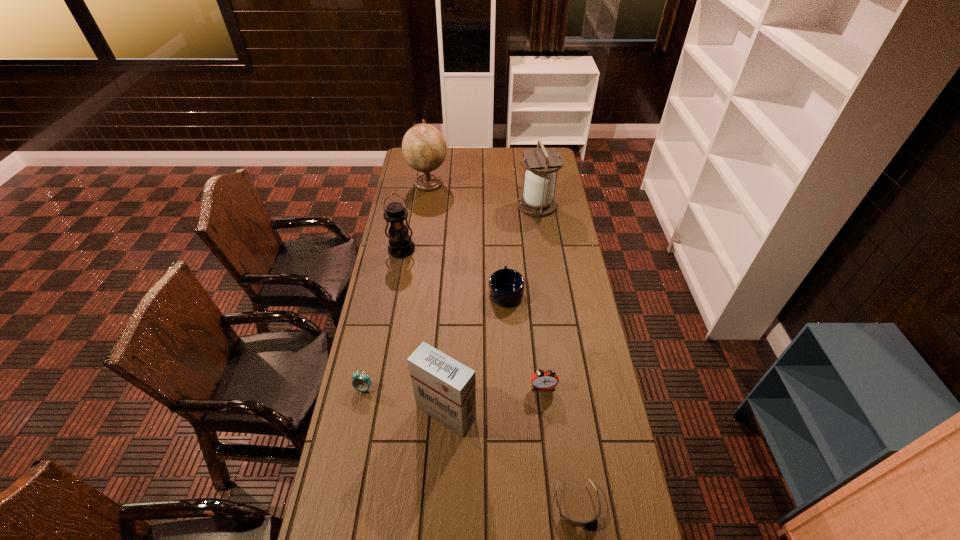
I want to click on empty space that is in between the cigarette case and the right alarm clock, so (494, 400).

This screenshot has width=960, height=540. Identify the location of free space between the right alarm clock and the goggles. pos(560,445).

Identify the location of free spot between the fourth shortest object and the nearer lantern. (472, 318).

The image size is (960, 540). I want to click on blank region between the shorter alarm clock and the right lantern, so click(450, 296).

Identify the location of free spot between the left alarm clock and the fifth nearest object. The height and width of the screenshot is (540, 960). (435, 340).

In order to click on blank region between the nearer lantern and the fourth farthest object in this screenshot , I will do `click(453, 271)`.

This screenshot has width=960, height=540. Identify the location of blank region between the goggles and the globe. point(502,343).

The width and height of the screenshot is (960, 540). I want to click on vacant region between the nearer lantern and the right lantern, so click(x=469, y=227).

Image resolution: width=960 pixels, height=540 pixels. I want to click on vacant space that's between the fifth nearest object and the right lantern, so click(521, 248).

Identify the location of object identified as the sixth closest to the cigarette case. The image size is (960, 540). (538, 200).